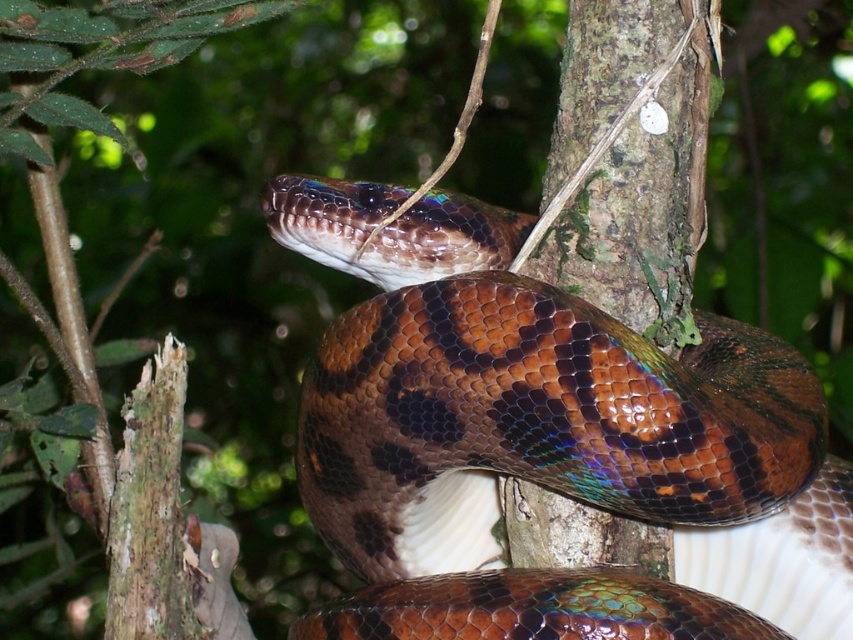
Question: Is shiny brown snake at center smaller than green mossy bark at center?

Choices:
 (A) yes
 (B) no

Answer: (B)

Question: Which object appears closest to the camera in this image?

Choices:
 (A) green mossy bark at center
 (B) shiny brown snake at center

Answer: (B)

Question: Among these objects, which one is nearest to the camera?

Choices:
 (A) green mossy bark at center
 (B) shiny brown snake at center

Answer: (B)

Question: Is shiny brown snake at center above green mossy bark at center?

Choices:
 (A) no
 (B) yes

Answer: (A)

Question: Does shiny brown snake at center have a smaller size compared to green mossy bark at center?

Choices:
 (A) yes
 (B) no

Answer: (B)